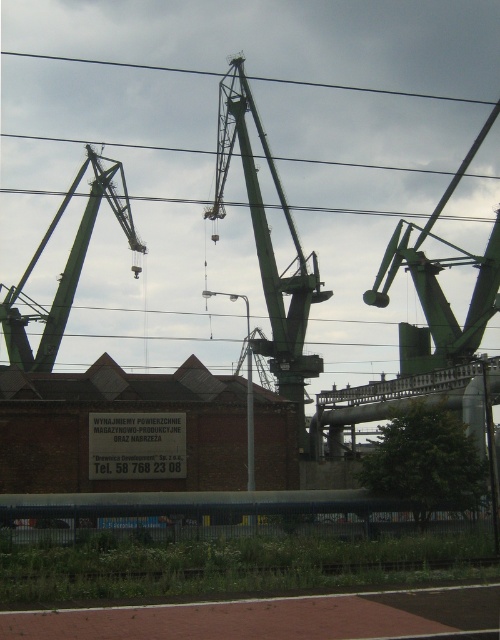
What is the spatial relationship between the green matte crane at center and the black wire at upper center?

The green matte crane at center is in front of the black wire at upper center.

You are a delivery truck driver arriving at the industrial site. You see two points marked on your map. The first point is at coordinates point [49,228] and the second point is at point [465,99]. Which point is closer to the brick building with the rental sign?

Point [49,228] is in front of point [465,99], so it is closer to the brick building with the rental sign.